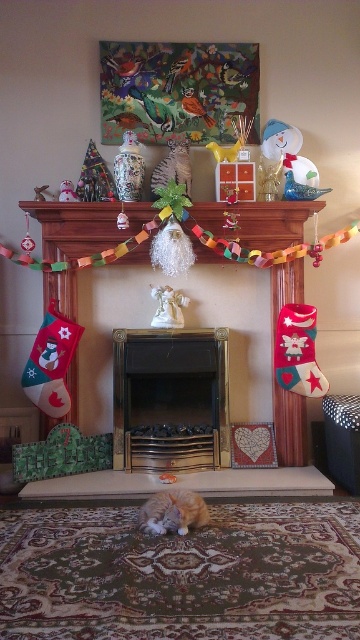
Which of these two, fluffy orange cat at lower center or matte ceramic vase at upper left, stands taller?

matte ceramic vase at upper left is taller.

Does fluffy orange cat at lower center have a lesser width compared to matte ceramic vase at upper left?

Incorrect, fluffy orange cat at lower center's width is not less than matte ceramic vase at upper left's.

Who is more forward, (168, 525) or (69, 198)?

Point (168, 525) is in front.

The height and width of the screenshot is (640, 360). I want to click on fluffy orange cat at lower center, so click(x=173, y=513).

Which is below, fluffy orange cat at lower center or white porcelain angel at center?

fluffy orange cat at lower center is lower down.

Does point (154, 499) come in front of point (173, 316)?

Yes.

Is point (200, 513) positioned after point (163, 289)?

No, (200, 513) is in front of (163, 289).

You are a GUI agent. You are given a task and a screenshot of the screen. Output one action in this format:
    pyautogui.click(x=<x>, y=<y>)
    Task: Click on the fluffy orange cat at lower center
    This screenshot has width=360, height=640.
    Given the screenshot: What is the action you would take?
    [x=173, y=513]

Describe the element at coordinates (171, 400) in the screenshot. I see `gold metallic fireplace at center` at that location.

Between gold metallic fireplace at center and matte ceramic vase at upper left, which one is positioned higher?

Positioned higher is matte ceramic vase at upper left.

Is point (200, 371) positioned before point (65, 189)?

No, (200, 371) is behind (65, 189).

Locate an element on the screen. This screenshot has width=360, height=640. gold metallic fireplace at center is located at coordinates (171, 400).